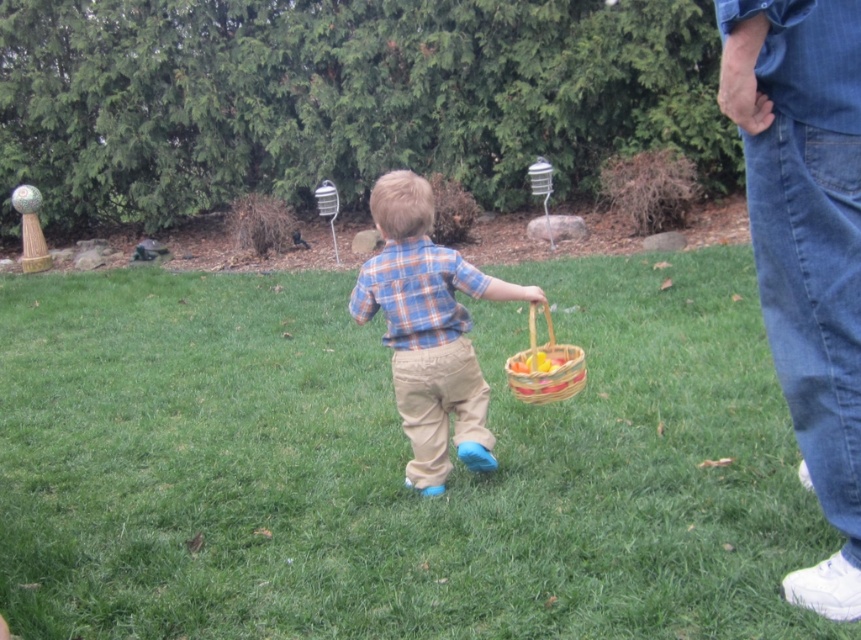
You are a photographer trying to capture the plaid shirt at center and the woven wood basket at center in a single shot. Based on their positions, which object should you focus on first to ensure both are in frame?

The plaid shirt at center is above the woven wood basket at center, so focusing on the plaid shirt at center first will ensure both are in frame as the basket will be below it within the same shot.

You are a photographer trying to capture the child in the scene. Since you want to focus on the denim jeans at right and plaid shirt at center, which one should you zoom in on to ensure it appears larger in your photo?

The plaid shirt at center should be zoomed in on because it has a larger size compared to the denim jeans at right.